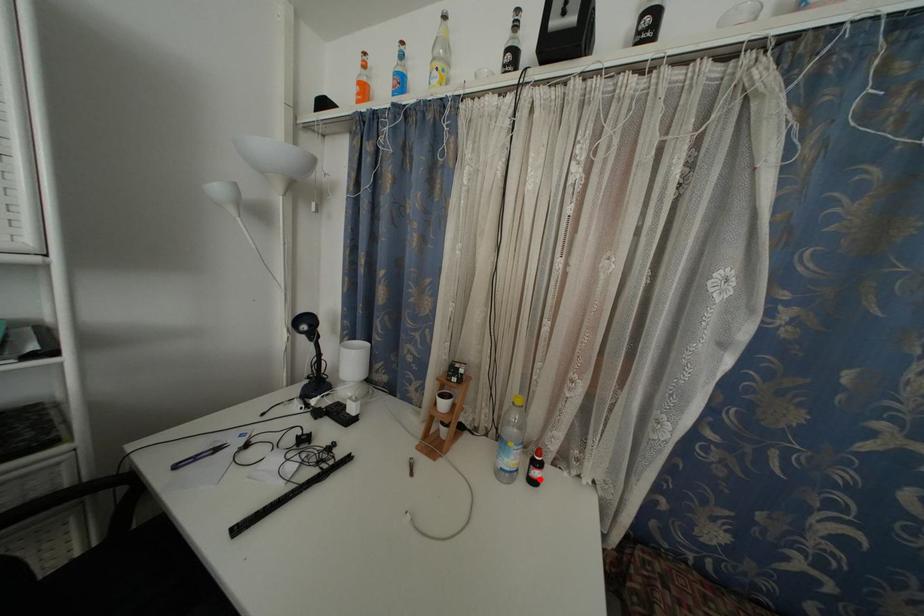
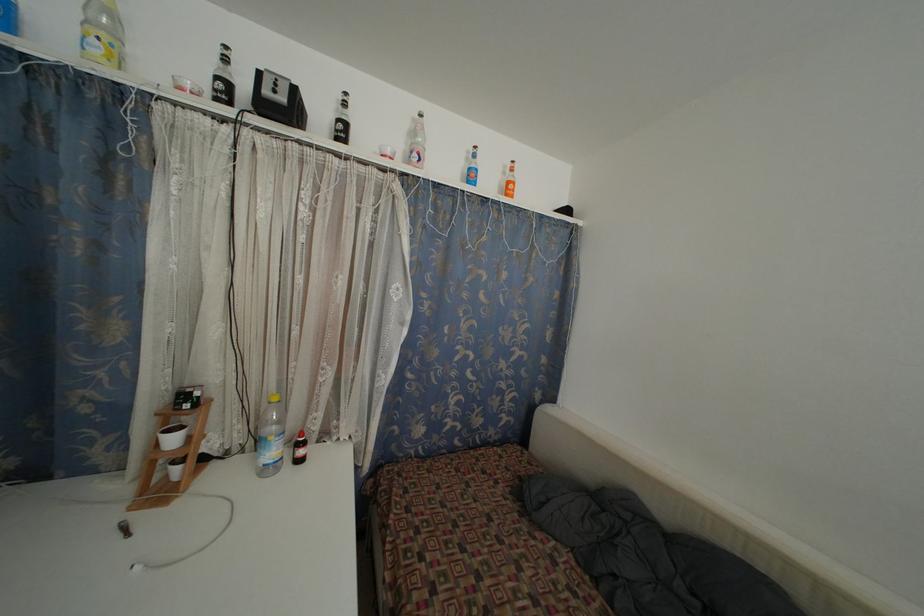
In the second image, find the point that corresponds to the highlighted location in the first image.

(305, 458)